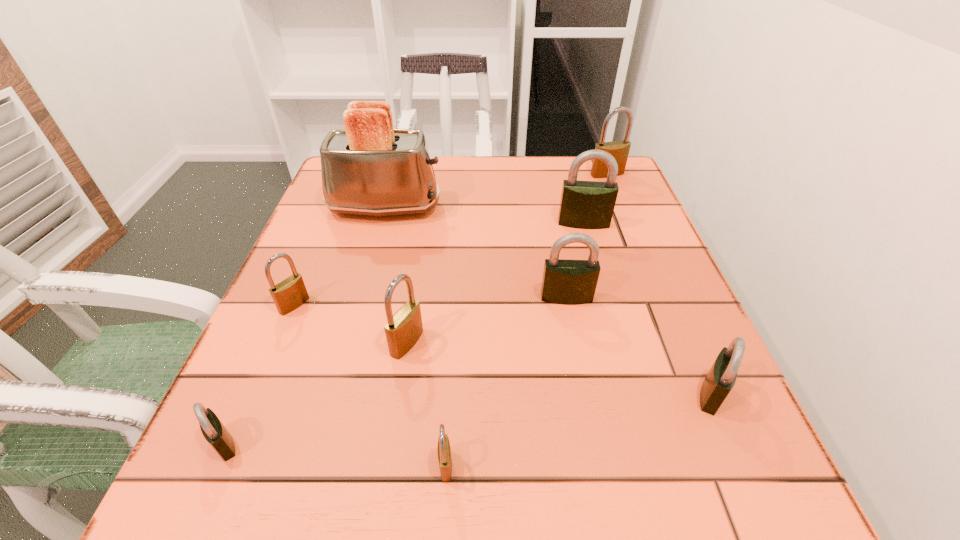
I want to click on vacant space in between the second biggest black padlock and the toaster, so click(475, 253).

The width and height of the screenshot is (960, 540). I want to click on free space between the farthest black padlock and the leftmost brass padlock, so click(x=439, y=264).

Locate an element on the screen. The image size is (960, 540). vacant space that's between the second farthest padlock and the third nearest brass padlock is located at coordinates (439, 264).

I want to click on vacant space that's between the second biggest black padlock and the toaster, so click(475, 253).

At what (x,y) coordinates should I click in order to perform the action: click on unoccupied area between the rightmost brass padlock and the leftmost brass padlock. Please return your answer as a coordinate pair (x, y). The height and width of the screenshot is (540, 960). Looking at the image, I should click on (450, 240).

Find the location of a particular element. The height and width of the screenshot is (540, 960). free space between the third farthest black padlock and the fifth object from left to right is located at coordinates coord(579,429).

Where is `empty space that is in between the third brass padlock from left to right and the second smallest brass padlock`? This screenshot has height=540, width=960. empty space that is in between the third brass padlock from left to right and the second smallest brass padlock is located at coordinates (370, 385).

This screenshot has width=960, height=540. Identify the location of unoccupied position between the sixth farthest padlock and the seventh nearest padlock. (647, 308).

Point out which object is positioned as the second nearest to the leftmost black padlock. Please provide its 2D coordinates. Your answer should be formatted as a tuple, i.e. [(x, y)], where the tuple contains the x and y coordinates of a point satisfying the conditions above.

[(403, 329)]

Find the location of `object that is the fourth closest to the tallest object`. object that is the fourth closest to the tallest object is located at coordinates (403, 329).